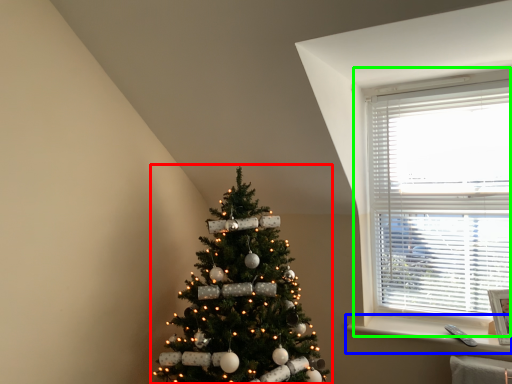
Question: Considering the real-world distances, which object is closest to christmas tree (highlighted by a red box)? window sill (highlighted by a blue box) or window (highlighted by a green box).

Choices:
 (A) window sill
 (B) window

Answer: (A)